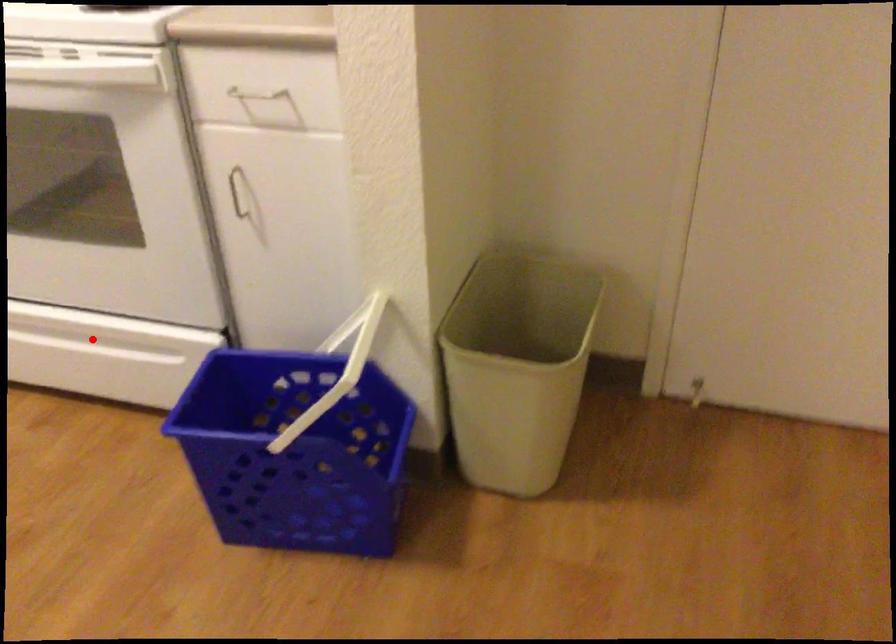
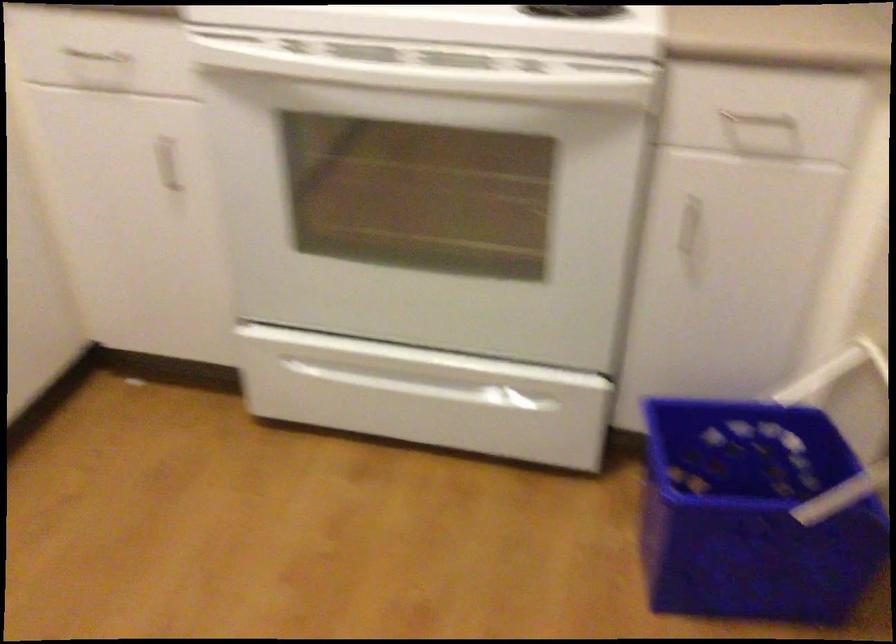
Question: A red point is marked in image1. In image2, is the corresponding 3D point closer to the camera or farther? Reply with the corresponding letter.

Choices:
 (A) The corresponding 3D point is closer.
 (B) The corresponding 3D point is farther.

Answer: (A)